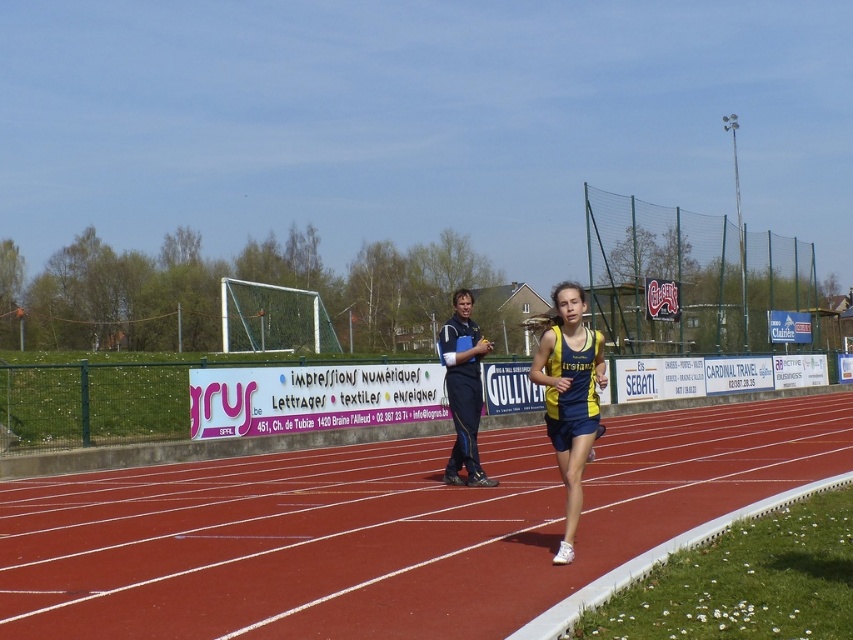
You are a photographer positioned at the starting line of the athletics track. You want to capture a photo of the blue fabric jacket at center and the rubberized red track at center in the same frame. Based on their sizes, which object will appear larger in the photo?

The rubberized red track at center might be wider than blue fabric jacket at center, so it will likely appear larger in the photo.

You are a photographer at the athletics track. You want to capture a photo of the yellow fabric running suit at center and the blue fabric jacket at center. Which one should you zoom in on to make sure it fills the frame better?

The yellow fabric running suit at center is bigger than the blue fabric jacket at center, so you should zoom in on the yellow fabric running suit at center to make sure it fills the frame better.